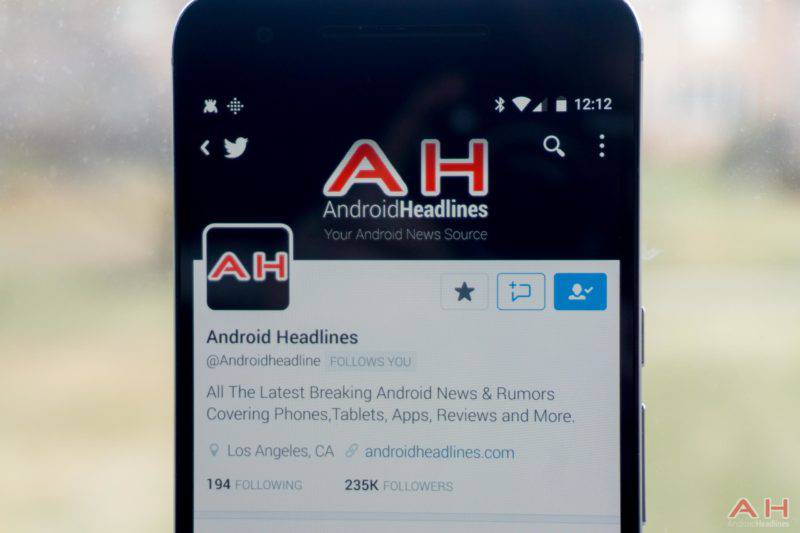
Where is `phone`? phone is located at coordinates (413, 320).